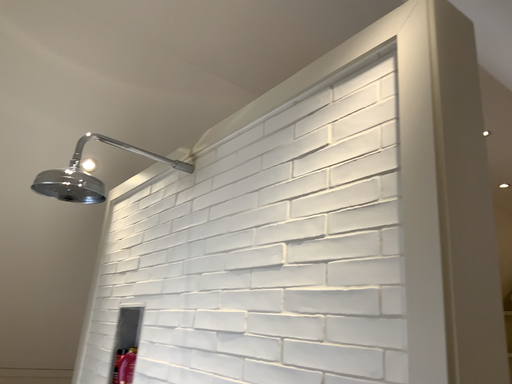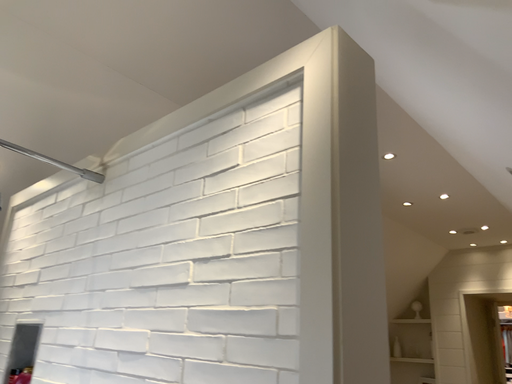
Question: Which way did the camera rotate in the video?

Choices:
 (A) rotated right
 (B) rotated left

Answer: (A)